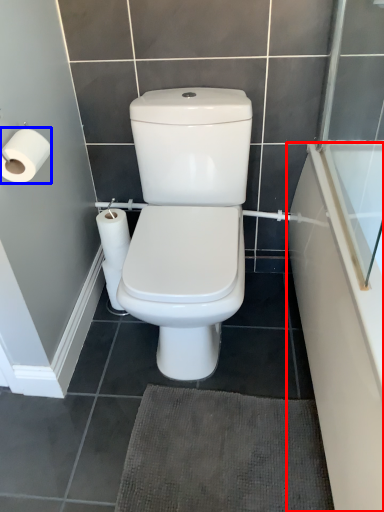
Question: Which point is further to the camera, bath (highlighted by a red box) or toilet paper (highlighted by a blue box)?

Choices:
 (A) bath
 (B) toilet paper

Answer: (B)